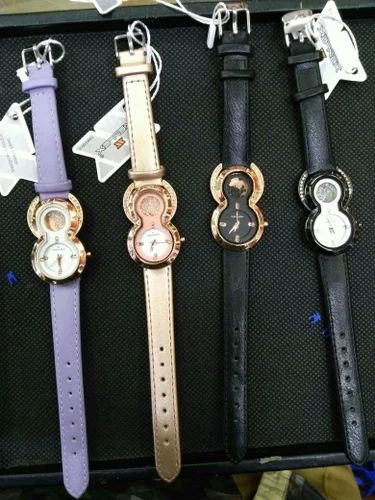
The height and width of the screenshot is (500, 375). Find the location of `blue marks in display case fabric`. blue marks in display case fabric is located at coordinates (13, 275), (316, 315).